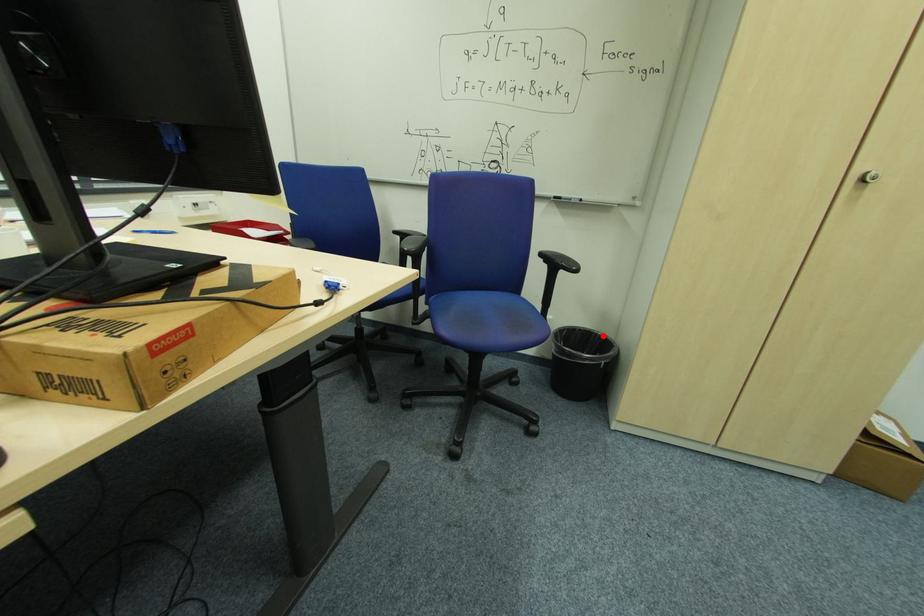
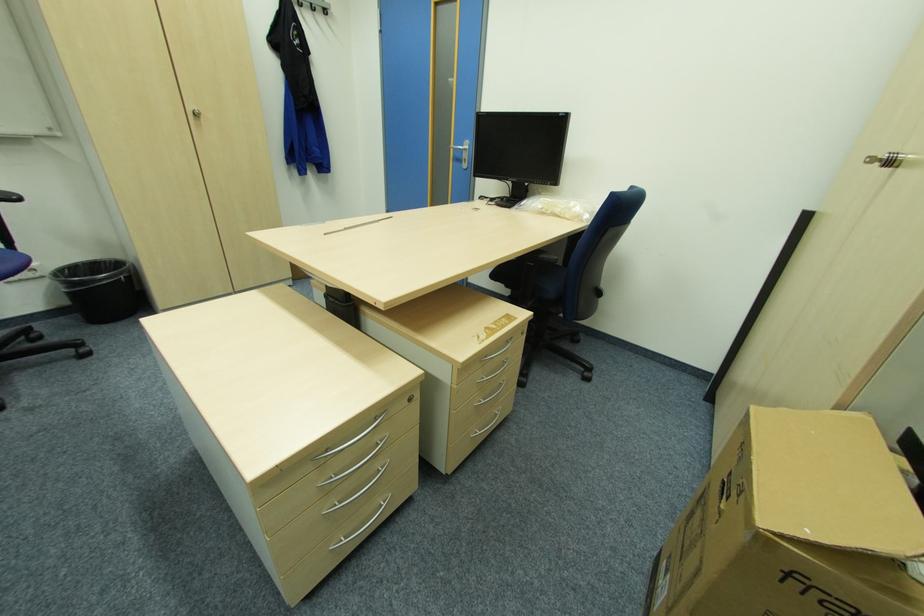
Locate, in the second image, the point that corresponds to the highlighted location in the first image.

(113, 261)